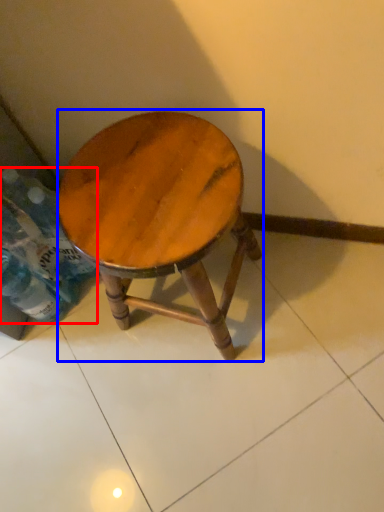
Question: Which of the following is the closest to the observer, bottle (highlighted by a red box) or stool (highlighted by a blue box)?

Choices:
 (A) bottle
 (B) stool

Answer: (B)